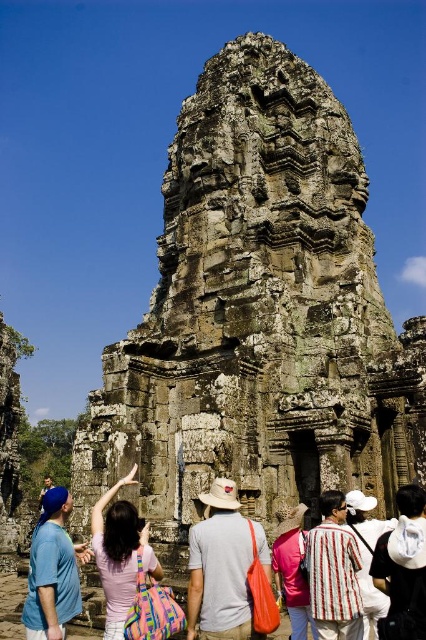
Can you confirm if gray fabric hat at center is shorter than pink fabric bag at center?

Correct, gray fabric hat at center is not as tall as pink fabric bag at center.

Does point (238, 605) lie in front of point (144, 554)?

Yes, it is in front of point (144, 554).

Between point (213, 616) and point (118, 605), which one is positioned behind?

The point (118, 605) is behind.

Image resolution: width=426 pixels, height=640 pixels. I want to click on gray fabric hat at center, so click(222, 566).

Can you confirm if striped fabric shirt at center is positioned to the left of white striped shirt at center?

Yes, striped fabric shirt at center is to the left of white striped shirt at center.

Between point (324, 566) and point (367, 573), which one is positioned in front?

Point (324, 566) is in front.

Locate an element on the screen. The width and height of the screenshot is (426, 640). striped fabric shirt at center is located at coordinates (333, 572).

Is white cotton backpack at center closer to the viewer compared to blue denim jeans at lower left?

That is True.

Does point (397, 502) come closer to viewer compared to point (51, 481)?

Yes, it is.

This screenshot has width=426, height=640. In order to click on white cotton backpack at center in this screenshot , I will do `click(402, 568)`.